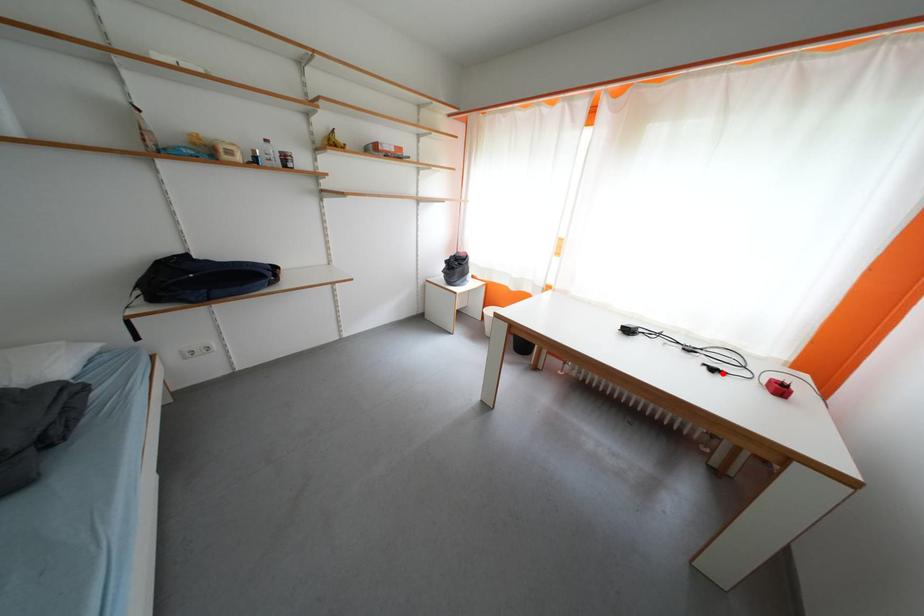
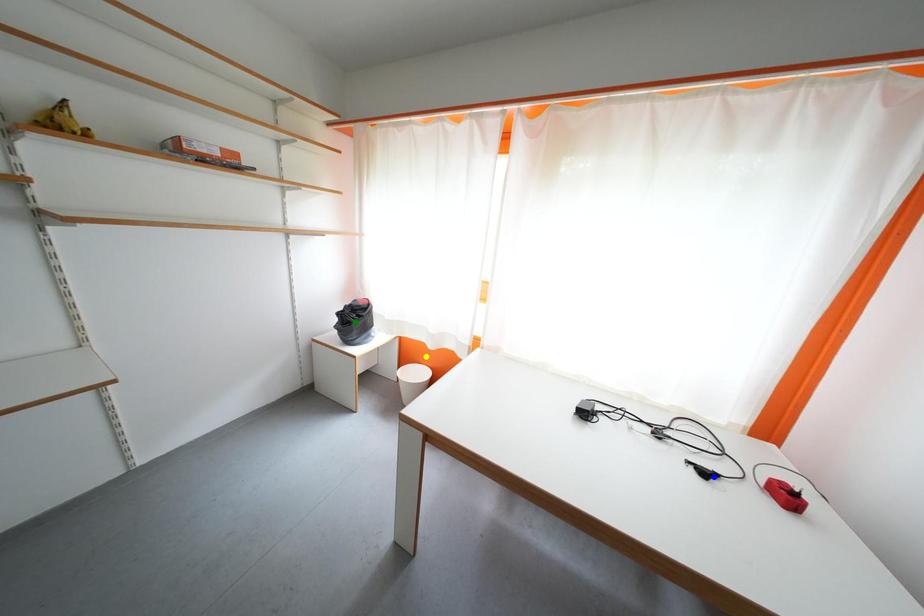
Question: I am providing you with two images of the same scene from different viewpoints. A red point is marked on the first image. You are given multiple points on the second image. Which mark in image 2 goes with the point in image 1?

Choices:
 (A) green point
 (B) blue point
 (C) yellow point

Answer: (B)